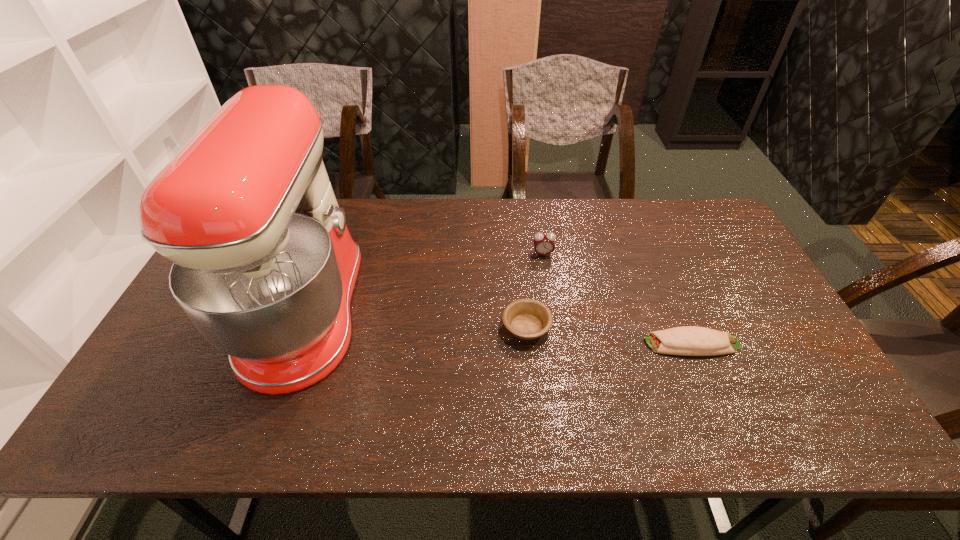
Find the location of a particular element. Image resolution: width=960 pixels, height=540 pixels. the leftmost object is located at coordinates (264, 266).

The image size is (960, 540). In order to click on mixer in this screenshot , I will do `click(264, 266)`.

Where is `alarm clock`? This screenshot has width=960, height=540. alarm clock is located at coordinates (543, 243).

I want to click on bowl, so click(x=528, y=319).

In order to click on the shortest object in this screenshot , I will do `click(688, 340)`.

Where is `the rightmost object`? This screenshot has width=960, height=540. the rightmost object is located at coordinates (688, 340).

Locate an element on the screen. This screenshot has width=960, height=540. vacant point located on the front-facing side of the mixer is located at coordinates (491, 312).

At what (x,y) coordinates should I click in order to perform the action: click on vacant space located on the clock face of the third shortest object. Please return your answer as a coordinate pair (x, y). The width and height of the screenshot is (960, 540). Looking at the image, I should click on click(x=557, y=347).

This screenshot has width=960, height=540. Identify the location of blank area located on the left of the third tallest object. (427, 327).

The width and height of the screenshot is (960, 540). Find the location of `vacant position located 0.320m at the bitten end of the shortest object`. vacant position located 0.320m at the bitten end of the shortest object is located at coordinates (521, 344).